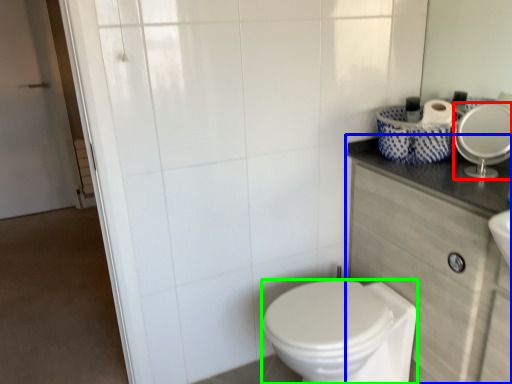
Question: Based on their relative distances, which object is farther from mirror (highlighted by a red box)? Choose from counter top (highlighted by a blue box) and bidet (highlighted by a green box).

Choices:
 (A) counter top
 (B) bidet

Answer: (B)